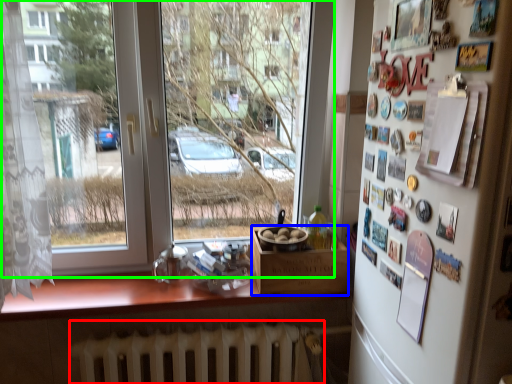
Question: Based on their relative distances, which object is nearer to radiator (highlighted by a red box)? Choose from box (highlighted by a blue box) and window (highlighted by a green box).

Choices:
 (A) box
 (B) window

Answer: (A)